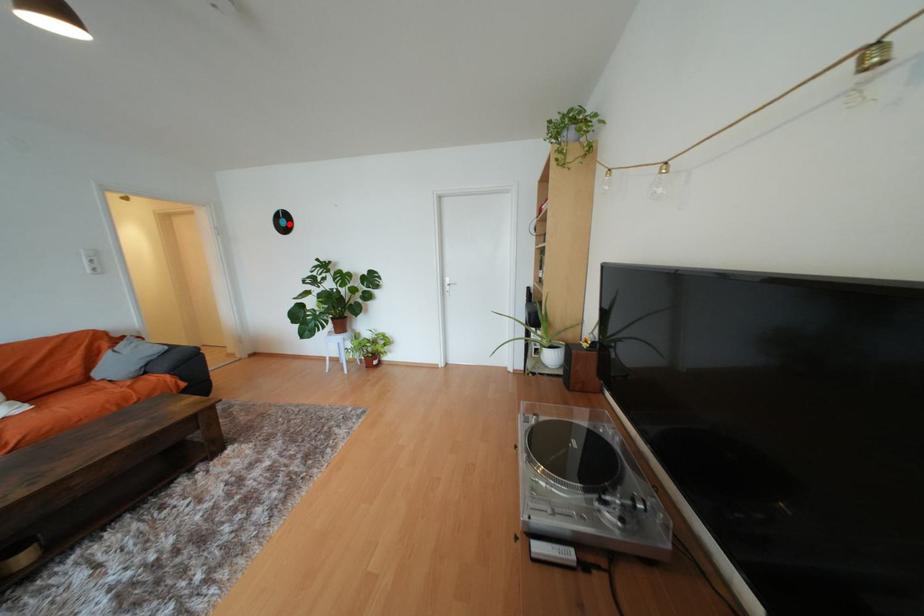
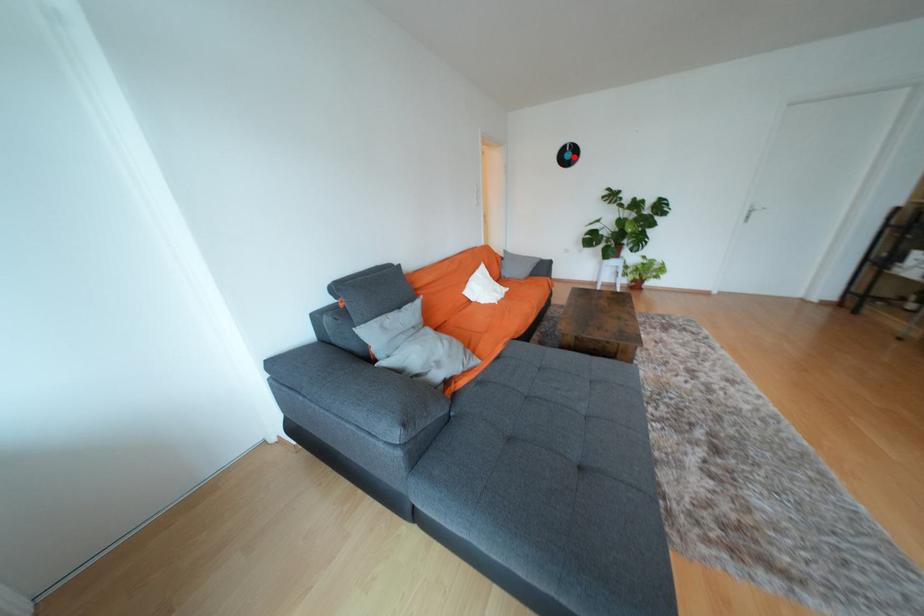
I am providing you with two images of the same scene from different viewpoints. A red point is marked on the first image and another point is marked on the second image. Is the red point in image1 aligned with the point shown in image2?

Yes